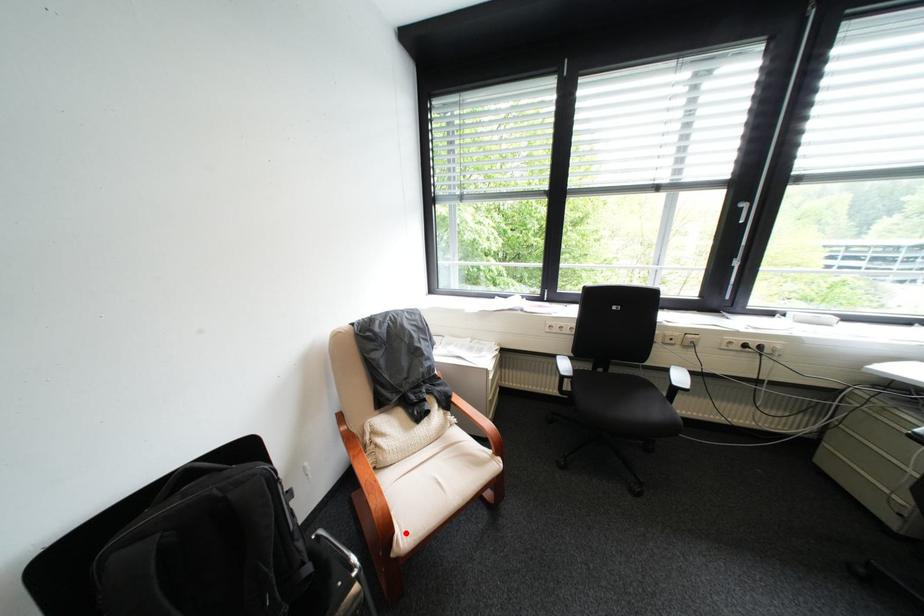
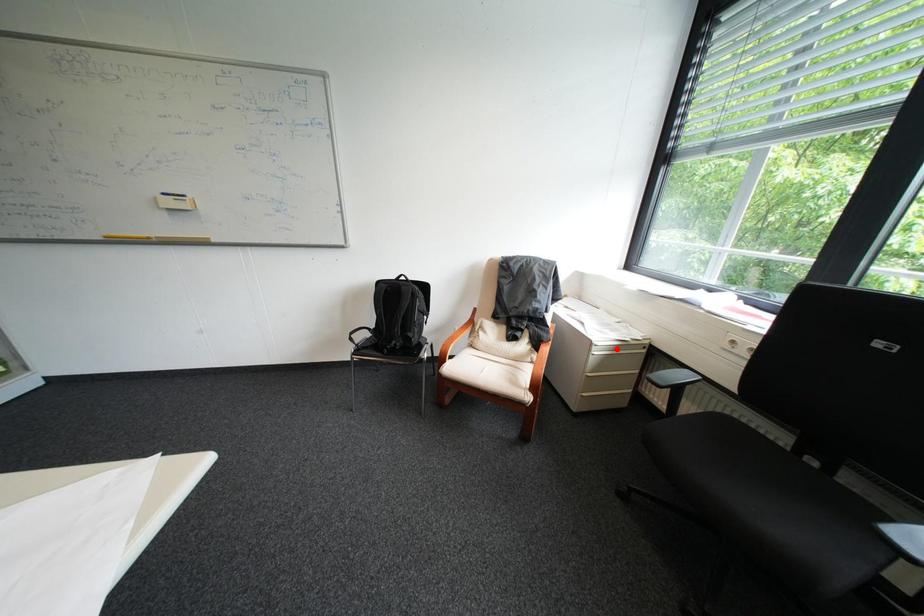
I am providing you with two images of the same scene from different viewpoints. A red point is marked on the first image and another point is marked on the second image. Do the highlighted points in image1 and image2 indicate the same real-world spot?

No